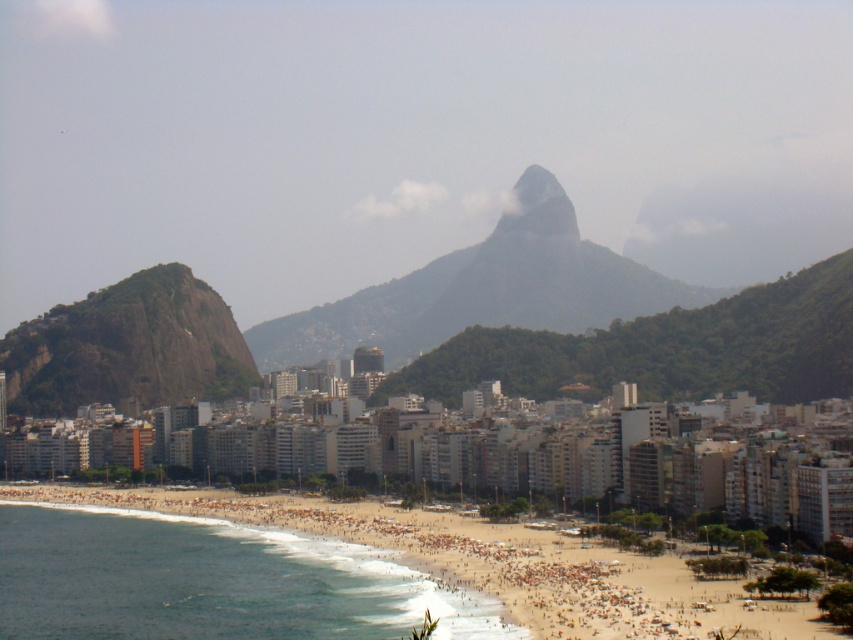
Question: Which point is farther to the camera?

Choices:
 (A) golden sand beach at lower left
 (B) rough granite rock at left
 (C) rocky gray mountain at center

Answer: (C)

Question: Among these points, which one is farthest from the camera?

Choices:
 (A) (189, 268)
 (B) (544, 182)

Answer: (B)

Question: Can you confirm if rocky gray mountain at center is smaller than rough granite rock at left?

Choices:
 (A) yes
 (B) no

Answer: (B)

Question: Is golden sand beach at lower left bigger than rough granite rock at left?

Choices:
 (A) yes
 (B) no

Answer: (B)

Question: In this image, where is rocky gray mountain at center located relative to rough granite rock at left?

Choices:
 (A) above
 (B) below

Answer: (A)

Question: Which point is closer to the camera?

Choices:
 (A) golden sand beach at lower left
 (B) rough granite rock at left
 (C) rocky gray mountain at center

Answer: (A)